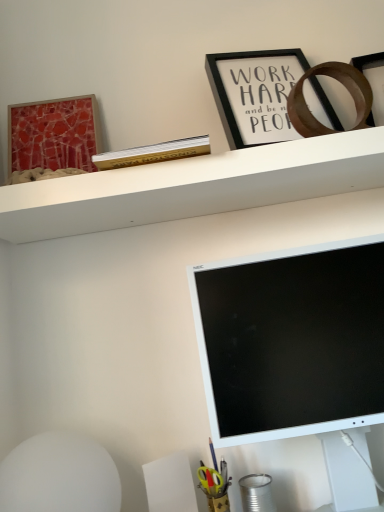
Question: Does matte red picture frame at upper left, acting as the second picture frame starting from the right, turn towards black matte picture frame at upper center, placed as the second picture frame when sorted from left to right?

Choices:
 (A) yes
 (B) no

Answer: (B)

Question: Considering the relative sizes of matte red picture frame at upper left, placed as the 1th picture frame when sorted from left to right, and black matte picture frame at upper center, placed as the second picture frame when sorted from left to right, in the image provided, is matte red picture frame at upper left, placed as the 1th picture frame when sorted from left to right, shorter than black matte picture frame at upper center, placed as the second picture frame when sorted from left to right,?

Choices:
 (A) yes
 (B) no

Answer: (B)

Question: Is matte red picture frame at upper left, acting as the second picture frame starting from the right, taller than black matte picture frame at upper center, the first picture frame when ordered from right to left?

Choices:
 (A) yes
 (B) no

Answer: (A)

Question: Is matte red picture frame at upper left, placed as the 1th picture frame when sorted from left to right, in front of black matte picture frame at upper center, the first picture frame when ordered from right to left?

Choices:
 (A) no
 (B) yes

Answer: (A)

Question: Can you confirm if matte red picture frame at upper left, placed as the 1th picture frame when sorted from left to right, is positioned to the left of black matte picture frame at upper center, placed as the second picture frame when sorted from left to right?

Choices:
 (A) no
 (B) yes

Answer: (B)

Question: From a real-world perspective, is black matte picture frame at upper center, the first picture frame when ordered from right to left, positioned above or below matte red picture frame at upper left, placed as the 1th picture frame when sorted from left to right?

Choices:
 (A) below
 (B) above

Answer: (B)

Question: Relative to matte red picture frame at upper left, acting as the second picture frame starting from the right, is black matte picture frame at upper center, placed as the second picture frame when sorted from left to right, in front or behind?

Choices:
 (A) behind
 (B) front

Answer: (B)

Question: Looking at their shapes, would you say black matte picture frame at upper center, the first picture frame when ordered from right to left, is wider or thinner than matte red picture frame at upper left, placed as the 1th picture frame when sorted from left to right?

Choices:
 (A) thin
 (B) wide

Answer: (B)

Question: Considering the relative positions of black matte picture frame at upper center, the first picture frame when ordered from right to left, and matte red picture frame at upper left, acting as the second picture frame starting from the right, in the image provided, is black matte picture frame at upper center, the first picture frame when ordered from right to left, to the left or to the right of matte red picture frame at upper left, acting as the second picture frame starting from the right,?

Choices:
 (A) right
 (B) left

Answer: (A)

Question: Looking at the image, does matte red picture frame at upper left, acting as the second picture frame starting from the right, seem bigger or smaller compared to metallic tin can at lower right?

Choices:
 (A) small
 (B) big

Answer: (B)

Question: In terms of height, does matte red picture frame at upper left, acting as the second picture frame starting from the right, look taller or shorter compared to metallic tin can at lower right?

Choices:
 (A) tall
 (B) short

Answer: (A)

Question: From a real-world perspective, is matte red picture frame at upper left, placed as the 1th picture frame when sorted from left to right, positioned above or below metallic tin can at lower right?

Choices:
 (A) below
 (B) above

Answer: (B)

Question: Is matte red picture frame at upper left, placed as the 1th picture frame when sorted from left to right, to the left or to the right of metallic tin can at lower right in the image?

Choices:
 (A) right
 (B) left

Answer: (B)

Question: Is point (258, 508) positioned closer to the camera than point (281, 150)?

Choices:
 (A) closer
 (B) farther

Answer: (B)

Question: Considering the positions of metallic tin can at lower right and white matte shelf at upper center in the image, is metallic tin can at lower right taller or shorter than white matte shelf at upper center?

Choices:
 (A) tall
 (B) short

Answer: (A)